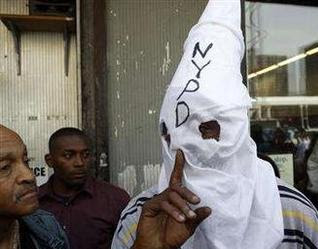
At what (x,y) coordinates should I click in order to perform the action: click on windows. Please return your answer as a coordinate pair (x, y). This screenshot has width=318, height=249. Looking at the image, I should click on (290, 23).